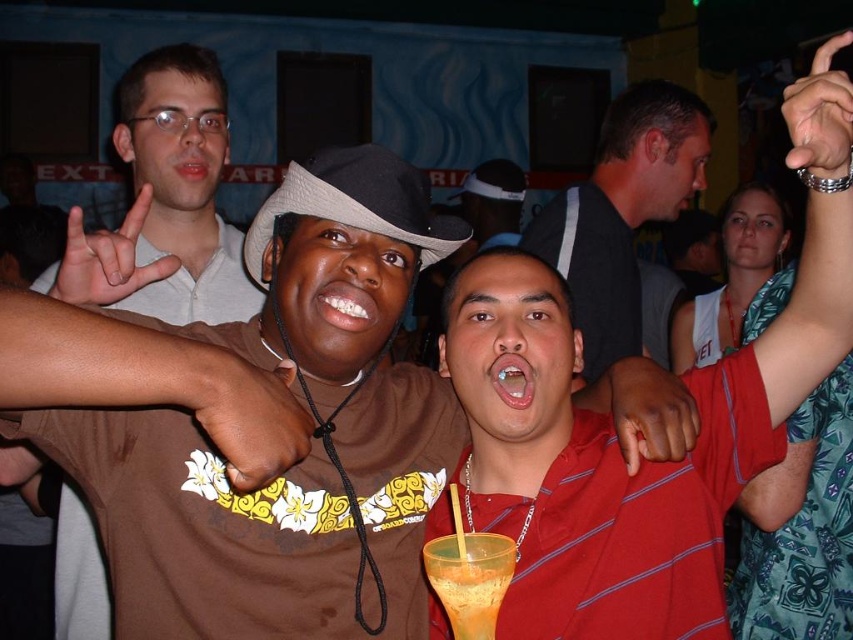
Question: Does white matte shirt at upper left appear under brown fabric cowboy hat at center?

Choices:
 (A) no
 (B) yes

Answer: (A)

Question: Which object is positioned closest to the brown fabric cowboy hat at center?

Choices:
 (A) smooth red shirt at center
 (B) white matte shirt at upper left

Answer: (B)

Question: Which is nearer to the matte skin hand at upper left?

Choices:
 (A) black matte shirt at center
 (B) brown fabric shirt at center
 (C) smooth red shirt at center

Answer: (B)

Question: From the image, what is the correct spatial relationship of brown fabric shirt at center in relation to brown fabric cowboy hat at center?

Choices:
 (A) below
 (B) above

Answer: (A)

Question: Which point appears closest to the camera in this image?

Choices:
 (A) (653, 378)
 (B) (178, 45)
 (C) (421, 264)

Answer: (A)

Question: Can you confirm if white matte shirt at upper left is positioned below orange smoothie at center?

Choices:
 (A) no
 (B) yes

Answer: (A)